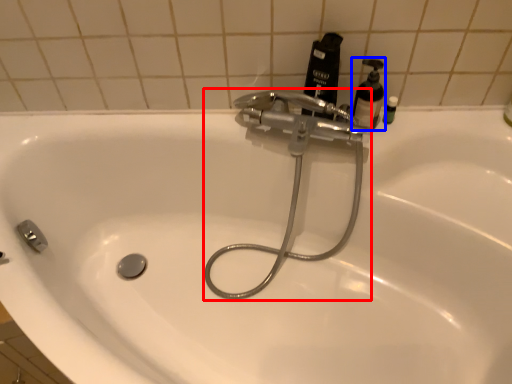
Question: Among these objects, which one is farthest to the camera, plumbing fixture (highlighted by a red box) or soap dispenser (highlighted by a blue box)?

Choices:
 (A) plumbing fixture
 (B) soap dispenser

Answer: (B)